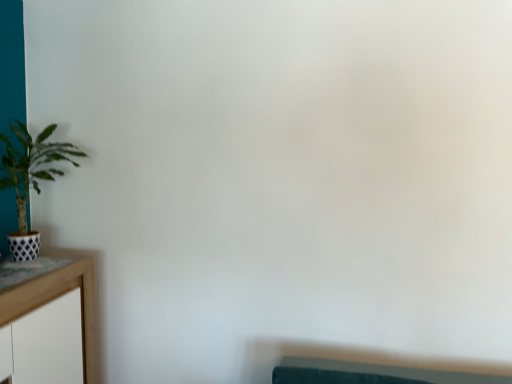
Question: Considering the relative sizes of green matte plant at left and wooden table at left in the image provided, is green matte plant at left taller than wooden table at left?

Choices:
 (A) no
 (B) yes

Answer: (A)

Question: From a real-world perspective, is green matte plant at left positioned over wooden table at left based on gravity?

Choices:
 (A) no
 (B) yes

Answer: (B)

Question: Considering the relative positions of green matte plant at left and wooden table at left in the image provided, is green matte plant at left to the left of wooden table at left from the viewer's perspective?

Choices:
 (A) no
 (B) yes

Answer: (A)

Question: Is green matte plant at left further to camera compared to wooden table at left?

Choices:
 (A) no
 (B) yes

Answer: (B)

Question: Is green matte plant at left at the right side of wooden table at left?

Choices:
 (A) yes
 (B) no

Answer: (A)

Question: Does green matte plant at left turn towards wooden table at left?

Choices:
 (A) yes
 (B) no

Answer: (B)

Question: Would you say wooden table at left is a long distance from green matte plant at left?

Choices:
 (A) no
 (B) yes

Answer: (A)

Question: Does wooden table at left have a greater height compared to green matte plant at left?

Choices:
 (A) yes
 (B) no

Answer: (A)

Question: From a real-world perspective, is wooden table at left positioned over green matte plant at left based on gravity?

Choices:
 (A) no
 (B) yes

Answer: (A)

Question: Is the depth of wooden table at left less than that of green matte plant at left?

Choices:
 (A) yes
 (B) no

Answer: (A)

Question: From the image's perspective, does wooden table at left appear lower than green matte plant at left?

Choices:
 (A) yes
 (B) no

Answer: (A)

Question: Does wooden table at left have a lesser height compared to green matte plant at left?

Choices:
 (A) no
 (B) yes

Answer: (A)

Question: Is green matte plant at left bigger or smaller than wooden table at left?

Choices:
 (A) big
 (B) small

Answer: (B)